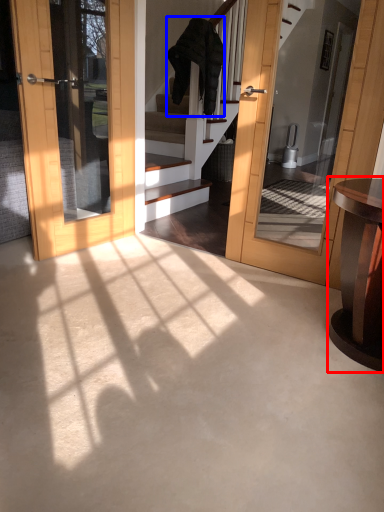
Question: Which object is further to the camera taking this photo, table (highlighted by a red box) or robe (highlighted by a blue box)?

Choices:
 (A) table
 (B) robe

Answer: (B)